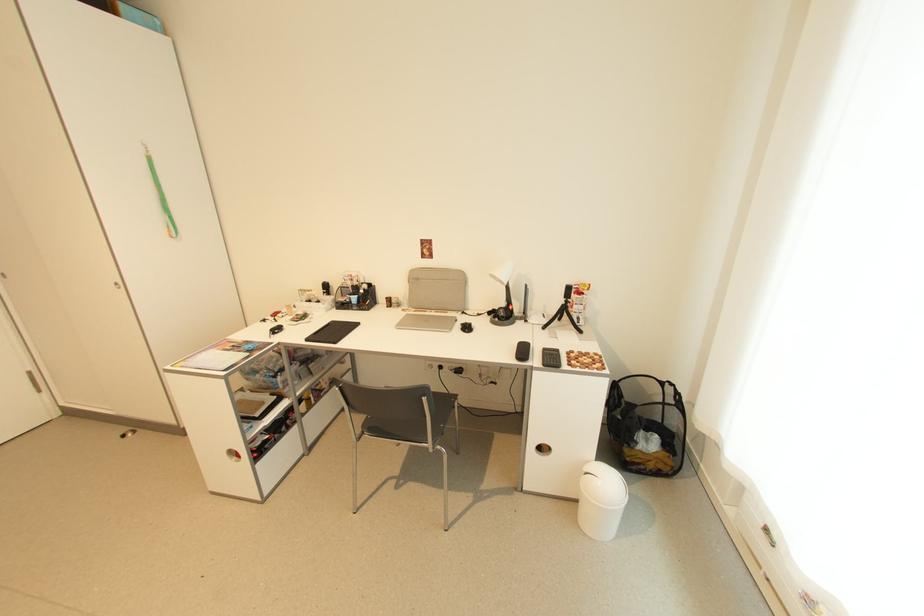
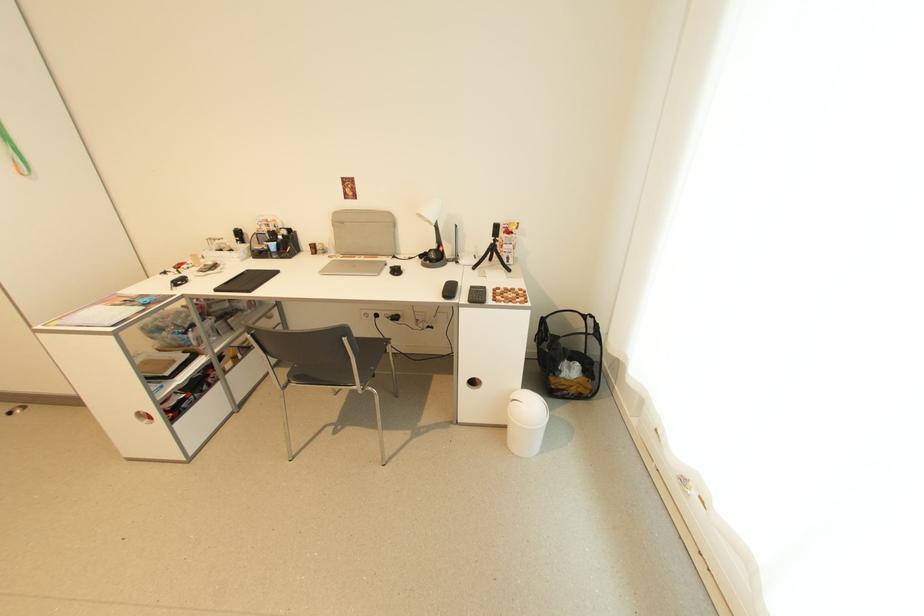
Locate, in the second image, the point that corresponds to [422,281] in the first image.

(347, 224)